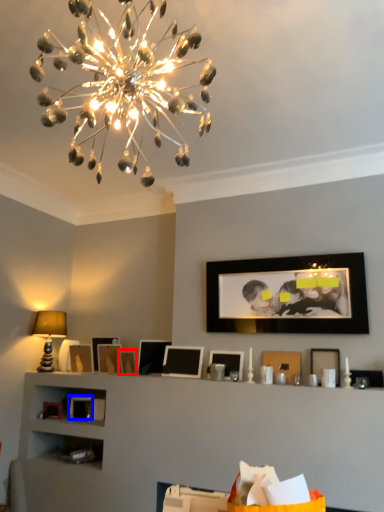
Question: Which object is closer to the camera taking this photo, picture frame (highlighted by a red box) or picture frame (highlighted by a blue box)?

Choices:
 (A) picture frame
 (B) picture frame

Answer: (A)